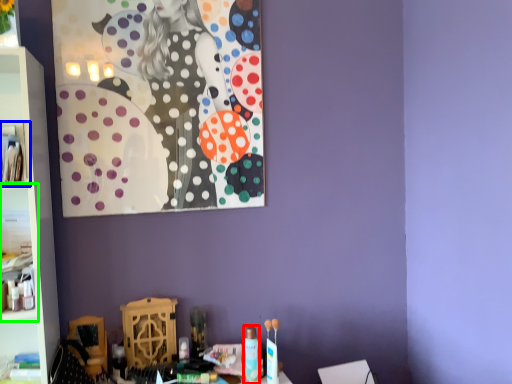
Question: Based on their relative distances, which object is nearer to toiletry (highlighted by a red box)? Choose from cabinet (highlighted by a blue box) and cabinet (highlighted by a green box).

Choices:
 (A) cabinet
 (B) cabinet

Answer: (B)